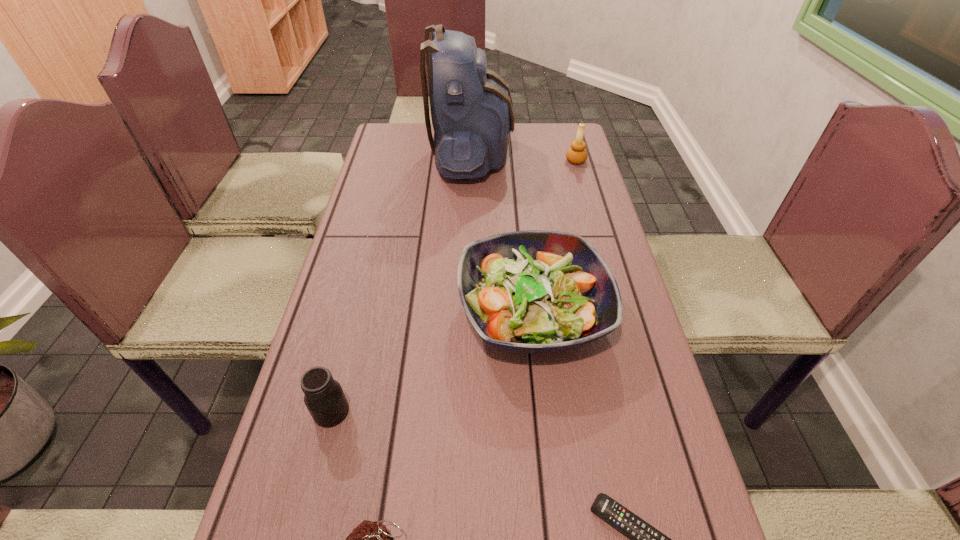
The image size is (960, 540). Identify the location of candle_holder at the far edge. (577, 154).

Where is `object situated at the left edge`? The width and height of the screenshot is (960, 540). object situated at the left edge is located at coordinates (324, 398).

Where is `candle_holder positioned at the right edge`? This screenshot has height=540, width=960. candle_holder positioned at the right edge is located at coordinates (577, 154).

The image size is (960, 540). Identify the location of salad plate positioned at the right edge. (535, 291).

The height and width of the screenshot is (540, 960). Identify the location of object present at the far right corner. (577, 154).

In the image, there is a desktop. Find the location of `vacant space at the left edge`. vacant space at the left edge is located at coordinates (362, 204).

Locate an element on the screen. The image size is (960, 540). free region at the right edge of the desktop is located at coordinates (624, 341).

Image resolution: width=960 pixels, height=540 pixels. In order to click on free spot between the tallest object and the candle_holder in this screenshot , I will do `click(523, 158)`.

The image size is (960, 540). I want to click on vacant space in between the third farthest object and the leftmost object, so click(432, 362).

Identify which object is located as the fourth nearest to the backpack. Please provide its 2D coordinates. Your answer should be formatted as a tuple, i.e. [(x, y)], where the tuple contains the x and y coordinates of a point satisfying the conditions above.

[(645, 539)]